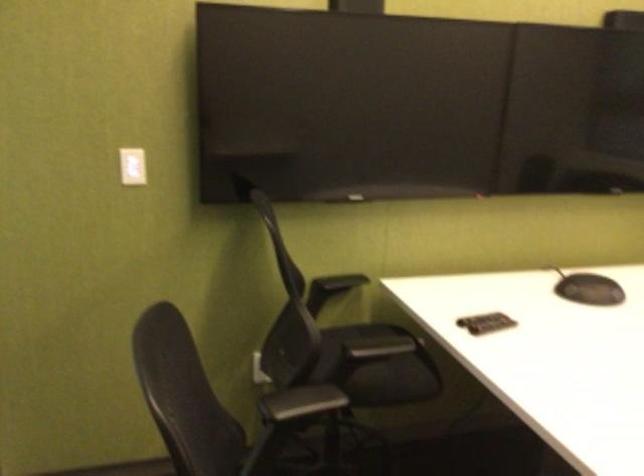
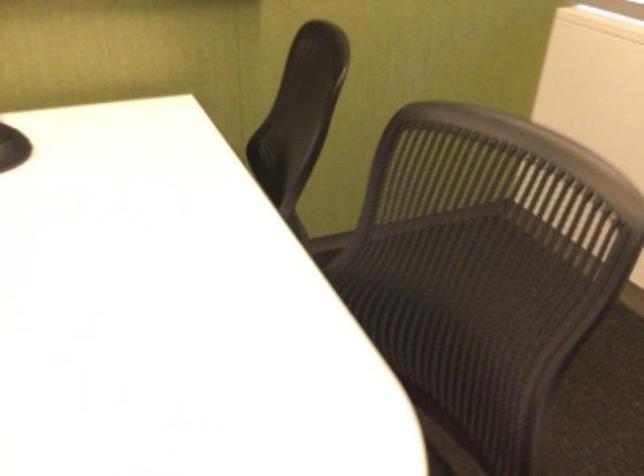
What movement of the cameraman would produce the second image?

The cameraman walked toward right, forward.